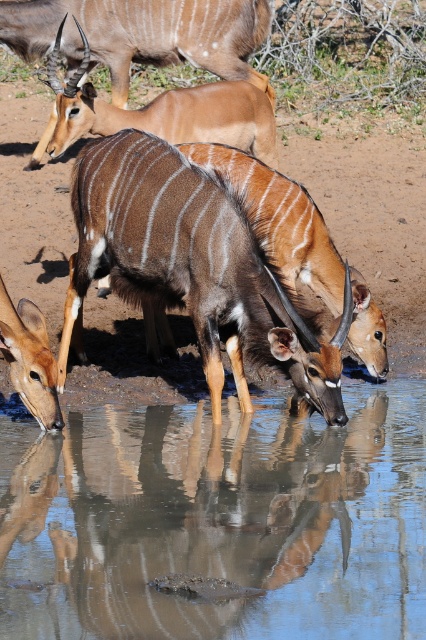
You are a wildlife photographer aiming to capture a clear photo of the brown glossy antelope at center and the brown glossy antelope at lower left. However, the antelope at lower left is partially obscured by the antelope at center. Which antelope is blocking the view of the other?

The brown glossy antelope at center is positioned over the brown glossy antelope at lower left, so it is blocking the view of the latter.

You are a wildlife photographer aiming to capture a closeup shot of the brown glossy antelope at center and the brown glossy antelope at lower left. Given that your camera lens can only focus on one antelope at a time, which antelope should you focus on to ensure the subject is in sharp focus when the other is slightly out of focus?

You should focus on the brown glossy antelope at center because it is larger in size, making it the primary subject for a closeup shot.